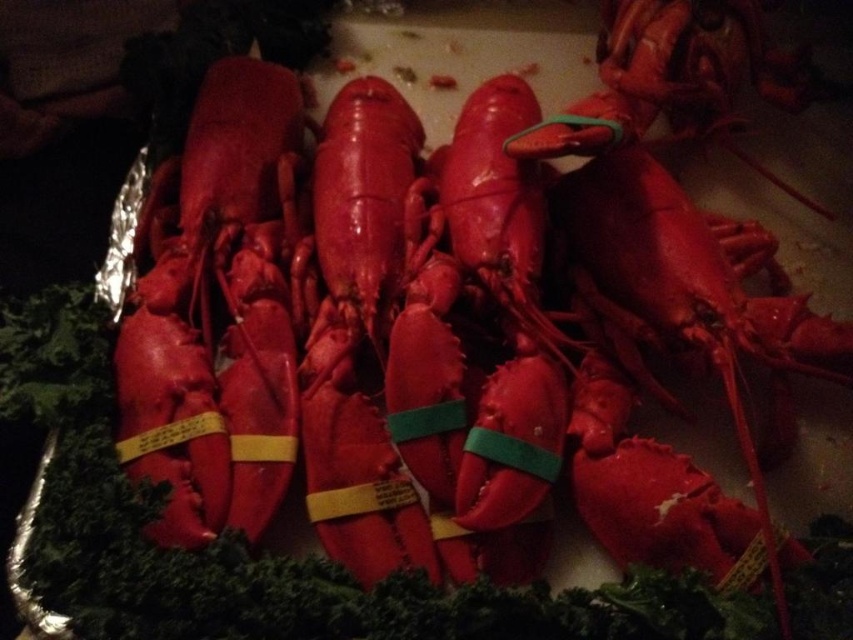
Question: Observing the image, what is the correct spatial positioning of shiny red lobster at left in reference to glossy red lobster at center?

Choices:
 (A) left
 (B) right

Answer: (A)

Question: Which point is farther to the camera?

Choices:
 (A) (283, 152)
 (B) (291, 262)

Answer: (A)

Question: Does shiny red lobster at left appear on the left side of glossy red lobster at center?

Choices:
 (A) yes
 (B) no

Answer: (A)

Question: Can you confirm if shiny red lobster at left is positioned to the left of glossy red lobster at center?

Choices:
 (A) no
 (B) yes

Answer: (B)